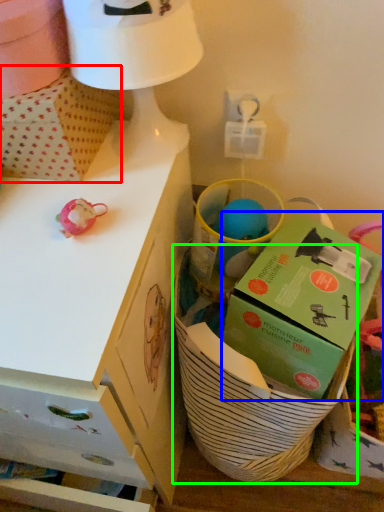
Question: Which object is the closest to the cardboard box (highlighted by a red box)? Choose among these: box (highlighted by a blue box) or basket (highlighted by a green box).

Choices:
 (A) box
 (B) basket

Answer: (A)